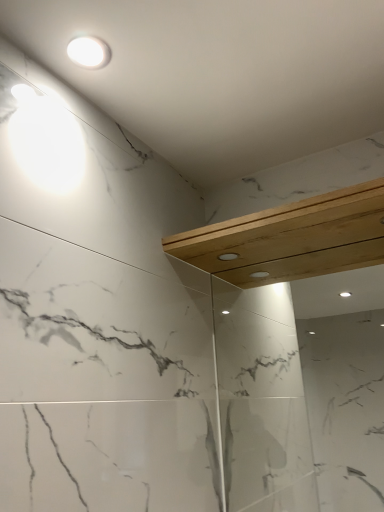
Find the location of `natural wood beam at upper center`. natural wood beam at upper center is located at coordinates 291,239.

The height and width of the screenshot is (512, 384). What do you see at coordinates (291, 239) in the screenshot? I see `natural wood beam at upper center` at bounding box center [291, 239].

Locate an element on the screen. The height and width of the screenshot is (512, 384). natural wood beam at upper center is located at coordinates (291, 239).